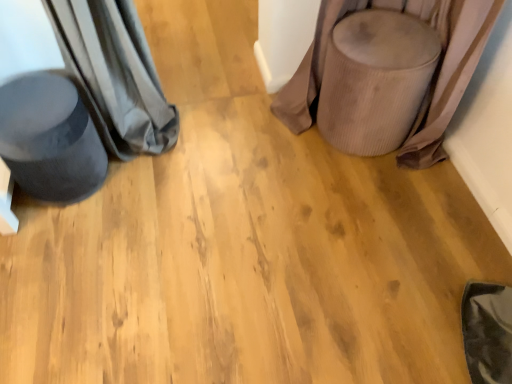
Question: Considering the relative positions of velvet beige stool at right, arranged as the first swivel chair when viewed from the right, and velvet dark grey swivel chair at left, which is the second swivel chair in right-to-left order, in the image provided, is velvet beige stool at right, arranged as the first swivel chair when viewed from the right, to the right of velvet dark grey swivel chair at left, which is the second swivel chair in right-to-left order, from the viewer's perspective?

Choices:
 (A) no
 (B) yes

Answer: (B)

Question: Could velvet dark grey swivel chair at left, which is the 1th swivel chair in left-to-right order, be considered to be inside velvet beige stool at right, acting as the 2th swivel chair starting from the left?

Choices:
 (A) yes
 (B) no

Answer: (B)

Question: Considering the relative positions of velvet beige stool at right, acting as the 2th swivel chair starting from the left, and velvet dark grey swivel chair at left, which is the second swivel chair in right-to-left order, in the image provided, is velvet beige stool at right, acting as the 2th swivel chair starting from the left, behind velvet dark grey swivel chair at left, which is the second swivel chair in right-to-left order,?

Choices:
 (A) no
 (B) yes

Answer: (B)

Question: From a real-world perspective, is velvet beige stool at right, acting as the 2th swivel chair starting from the left, positioned under velvet dark grey swivel chair at left, which is the second swivel chair in right-to-left order, based on gravity?

Choices:
 (A) no
 (B) yes

Answer: (A)

Question: From the image's perspective, is velvet beige stool at right, acting as the 2th swivel chair starting from the left, below velvet dark grey swivel chair at left, which is the second swivel chair in right-to-left order?

Choices:
 (A) yes
 (B) no

Answer: (B)

Question: Can you confirm if velvet beige stool at right, acting as the 2th swivel chair starting from the left, is shorter than velvet dark grey swivel chair at left, which is the 1th swivel chair in left-to-right order?

Choices:
 (A) yes
 (B) no

Answer: (B)

Question: Considering the relative sizes of velvet dark grey swivel chair at left, which is the second swivel chair in right-to-left order, and velvet beige stool at right, arranged as the first swivel chair when viewed from the right, in the image provided, is velvet dark grey swivel chair at left, which is the second swivel chair in right-to-left order, shorter than velvet beige stool at right, arranged as the first swivel chair when viewed from the right,?

Choices:
 (A) yes
 (B) no

Answer: (A)

Question: Is velvet beige stool at right, acting as the 2th swivel chair starting from the left, inside velvet dark grey swivel chair at left, which is the second swivel chair in right-to-left order?

Choices:
 (A) yes
 (B) no

Answer: (B)

Question: Is velvet dark grey swivel chair at left, which is the 1th swivel chair in left-to-right order, positioned beyond the bounds of velvet beige stool at right, arranged as the first swivel chair when viewed from the right?

Choices:
 (A) no
 (B) yes

Answer: (B)

Question: Does velvet dark grey swivel chair at left, which is the second swivel chair in right-to-left order, turn towards velvet beige stool at right, arranged as the first swivel chair when viewed from the right?

Choices:
 (A) yes
 (B) no

Answer: (B)

Question: Is velvet dark grey swivel chair at left, which is the 1th swivel chair in left-to-right order, bigger than velvet beige stool at right, acting as the 2th swivel chair starting from the left?

Choices:
 (A) no
 (B) yes

Answer: (A)

Question: Considering the relative positions of velvet dark grey swivel chair at left, which is the 1th swivel chair in left-to-right order, and velvet beige stool at right, acting as the 2th swivel chair starting from the left, in the image provided, is velvet dark grey swivel chair at left, which is the 1th swivel chair in left-to-right order, to the right of velvet beige stool at right, acting as the 2th swivel chair starting from the left, from the viewer's perspective?

Choices:
 (A) yes
 (B) no

Answer: (B)

Question: Considering the relative positions of velvet beige stool at right, acting as the 2th swivel chair starting from the left, and velvet dark grey swivel chair at left, which is the 1th swivel chair in left-to-right order, in the image provided, is velvet beige stool at right, acting as the 2th swivel chair starting from the left, to the left or to the right of velvet dark grey swivel chair at left, which is the 1th swivel chair in left-to-right order,?

Choices:
 (A) right
 (B) left

Answer: (A)